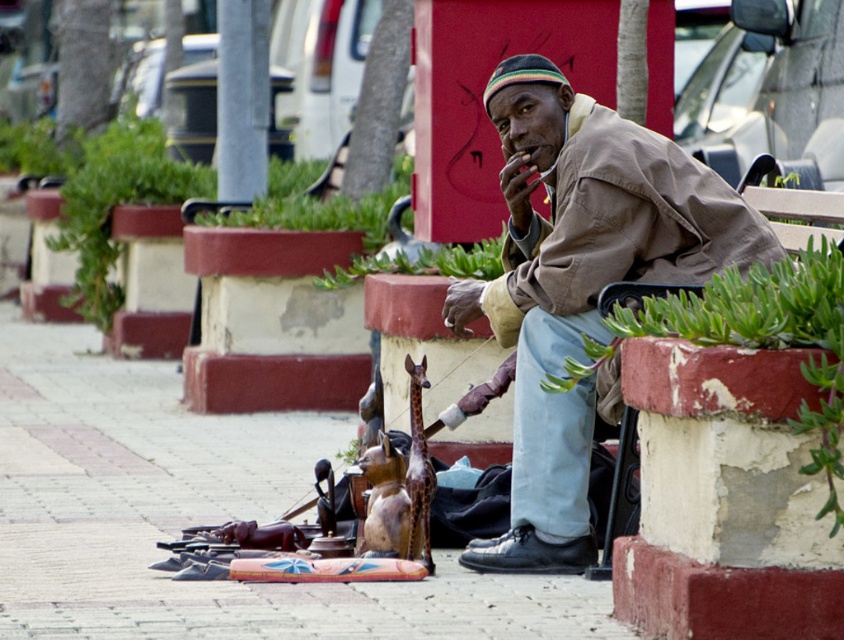
You are a delivery person who needs to place a package on the bench where the brown cotton jacket at center is. The package is as wide as the wooden figurines at lower center. Will the package fit on the bench?

The wooden figurines at lower center are wider than the brown cotton jacket at center. Since the package is as wide as the wooden figurines at lower center, it will not fit on the bench because the bench is narrower than the package.

You are a tourist walking on the sidewalk and see the wooden figurines at lower center and the brown cotton jacket at center. Which object is positioned more to the left?

The wooden figurines at lower center are positioned to the left of the brown cotton jacket at center, so they are more to the left.

You are a delivery person who needs to place a small package at the location marked by point (585, 264). The package must be placed on the brown cotton jacket at center. Is this possible?

The brown cotton jacket at center is located at point (585, 264), so yes, the package can be placed there as it is the exact location specified.